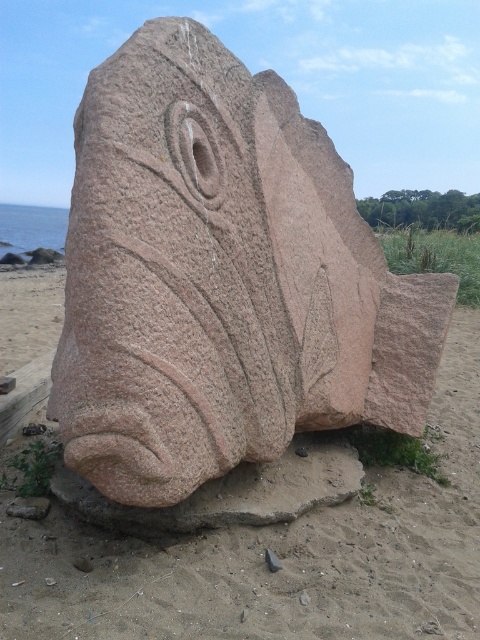
Question: Which point is closer to the camera taking this photo?

Choices:
 (A) (358, 602)
 (B) (162, 257)

Answer: (B)

Question: Can you confirm if pink granite fish at center is wider than pink stone fish at center?

Choices:
 (A) no
 (B) yes

Answer: (B)

Question: Among these points, which one is nearest to the camera?

Choices:
 (A) [26, 596]
 (B) [384, 376]

Answer: (A)

Question: Is pink granite fish at center further to the viewer compared to pink stone fish at center?

Choices:
 (A) yes
 (B) no

Answer: (B)

Question: Is pink granite fish at center bigger than pink stone fish at center?

Choices:
 (A) yes
 (B) no

Answer: (A)